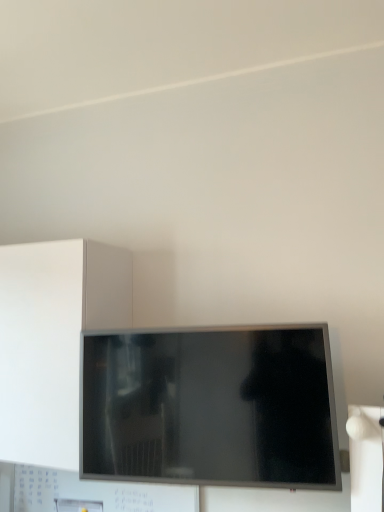
Question: Looking at the image, does matte black tv at center seem bigger or smaller compared to white matte cabinet at left?

Choices:
 (A) small
 (B) big

Answer: (A)

Question: In terms of height, does matte black tv at center look taller or shorter compared to white matte cabinet at left?

Choices:
 (A) short
 (B) tall

Answer: (A)

Question: From the image's perspective, is matte black tv at center above or below white matte cabinet at left?

Choices:
 (A) below
 (B) above

Answer: (A)

Question: Is white matte cabinet at left taller or shorter than matte black tv at center?

Choices:
 (A) tall
 (B) short

Answer: (A)

Question: Is white matte cabinet at left spatially inside matte black tv at center, or outside of it?

Choices:
 (A) inside
 (B) outside

Answer: (B)

Question: From the image's perspective, relative to matte black tv at center, is white matte cabinet at left above or below?

Choices:
 (A) below
 (B) above

Answer: (B)

Question: Relative to matte black tv at center, is white matte cabinet at left in front or behind?

Choices:
 (A) front
 (B) behind

Answer: (B)